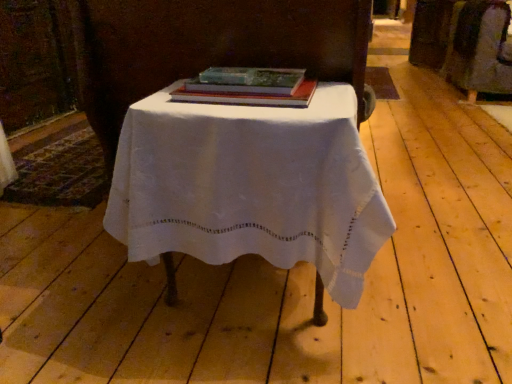
Describe the element at coordinates (248, 96) in the screenshot. I see `translucent green glass book at center` at that location.

I want to click on translucent green glass book at center, so click(x=248, y=96).

Find the location of a particular element. The width and height of the screenshot is (512, 384). white cloth-covered table at center is located at coordinates (251, 187).

Describe the element at coordinates (251, 187) in the screenshot. I see `white cloth-covered table at center` at that location.

The height and width of the screenshot is (384, 512). Identify the location of translucent green glass book at center. (248, 96).

In the image, is translucent green glass book at center on the left side or the right side of white cloth-covered table at center?

In the image, translucent green glass book at center appears on the left side of white cloth-covered table at center.

In the image, is translucent green glass book at center positioned in front of or behind white cloth-covered table at center?

Clearly, translucent green glass book at center is behind white cloth-covered table at center.

Which is farther, (234, 101) or (312, 119)?

The point (234, 101) is behind.

From the image's perspective, which is above, translucent green glass book at center or white cloth-covered table at center?

translucent green glass book at center.

From a real-world perspective, relative to white cloth-covered table at center, is translucent green glass book at center vertically above or below?

From a real-world perspective, translucent green glass book at center is physically above white cloth-covered table at center.

Between translucent green glass book at center and white cloth-covered table at center, which one has smaller width?

translucent green glass book at center.

Does translucent green glass book at center have a greater height compared to white cloth-covered table at center?

Incorrect, the height of translucent green glass book at center is not larger of that of white cloth-covered table at center.

In terms of size, does translucent green glass book at center appear bigger or smaller than white cloth-covered table at center?

Clearly, translucent green glass book at center is smaller in size than white cloth-covered table at center.

Is white cloth-covered table at center located within translucent green glass book at center?

No, white cloth-covered table at center is not inside translucent green glass book at center.

Is translucent green glass book at center in contact with white cloth-covered table at center?

No, translucent green glass book at center is not next to white cloth-covered table at center.

Does translucent green glass book at center turn towards white cloth-covered table at center?

No.

Can you tell me how much translucent green glass book at center and white cloth-covered table at center differ in facing direction?

The angle between the facing direction of translucent green glass book at center and the facing direction of white cloth-covered table at center is 1.37 degrees.

I want to click on table in front of the translucent green glass book at center, so click(x=251, y=187).

Considering the positions of objects white cloth-covered table at center and translucent green glass book at center in the image provided, who is more to the right, white cloth-covered table at center or translucent green glass book at center?

white cloth-covered table at center.

Between white cloth-covered table at center and translucent green glass book at center, which one is positioned in front?

white cloth-covered table at center is in front.

Is point (226, 210) less distant than point (291, 101)?

Yes, it is.

From the image's perspective, which one is positioned lower, white cloth-covered table at center or translucent green glass book at center?

white cloth-covered table at center, from the image's perspective.

From a real-world perspective, is white cloth-covered table at center on top of translucent green glass book at center?

No, from a real-world perspective, white cloth-covered table at center is not above translucent green glass book at center.

Considering the relative sizes of white cloth-covered table at center and translucent green glass book at center in the image provided, is white cloth-covered table at center thinner than translucent green glass book at center?

No.

Consider the image. Is white cloth-covered table at center taller or shorter than translucent green glass book at center?

white cloth-covered table at center is taller than translucent green glass book at center.

Who is bigger, white cloth-covered table at center or translucent green glass book at center?

white cloth-covered table at center is bigger.

Which is correct: white cloth-covered table at center is inside translucent green glass book at center, or outside of it?

white cloth-covered table at center is spatially situated outside translucent green glass book at center.

Is the surface of white cloth-covered table at center in direct contact with translucent green glass book at center?

white cloth-covered table at center and translucent green glass book at center are not in contact.

Is white cloth-covered table at center facing towards translucent green glass book at center?

No, white cloth-covered table at center is not aimed at translucent green glass book at center.

Can you tell me how much white cloth-covered table at center and translucent green glass book at center differ in facing direction?

1.37 degrees separate the facing orientations of white cloth-covered table at center and translucent green glass book at center.

At what (x,y) coordinates should I click in order to perform the action: click on book on the left of white cloth-covered table at center. Please return your answer as a coordinate pair (x, y). Image resolution: width=512 pixels, height=384 pixels. Looking at the image, I should click on (248, 96).

Find the location of `table lying below the translucent green glass book at center (from the image's perspective)`. table lying below the translucent green glass book at center (from the image's perspective) is located at coordinates (251, 187).

Locate an element on the screen. book that is above the white cloth-covered table at center (from a real-world perspective) is located at coordinates (248, 96).